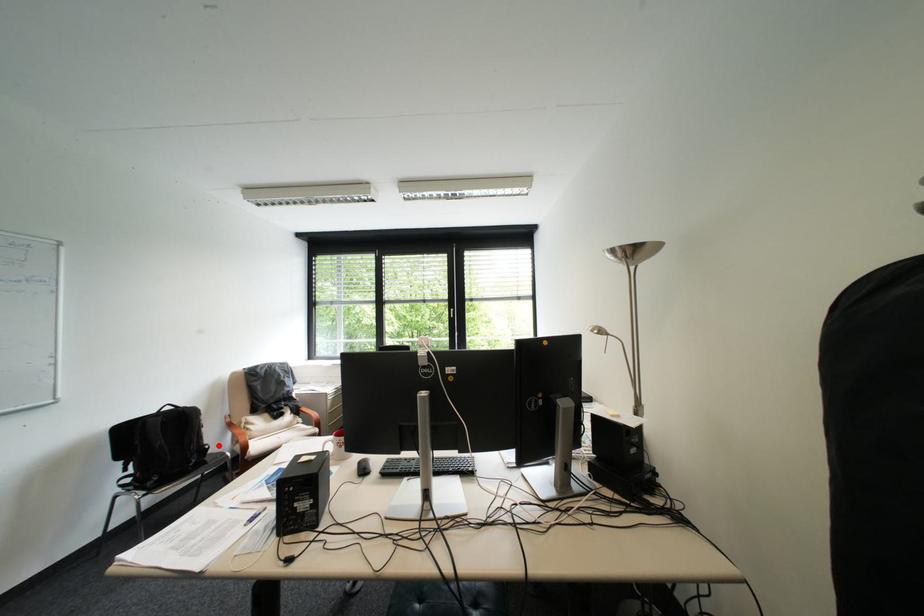
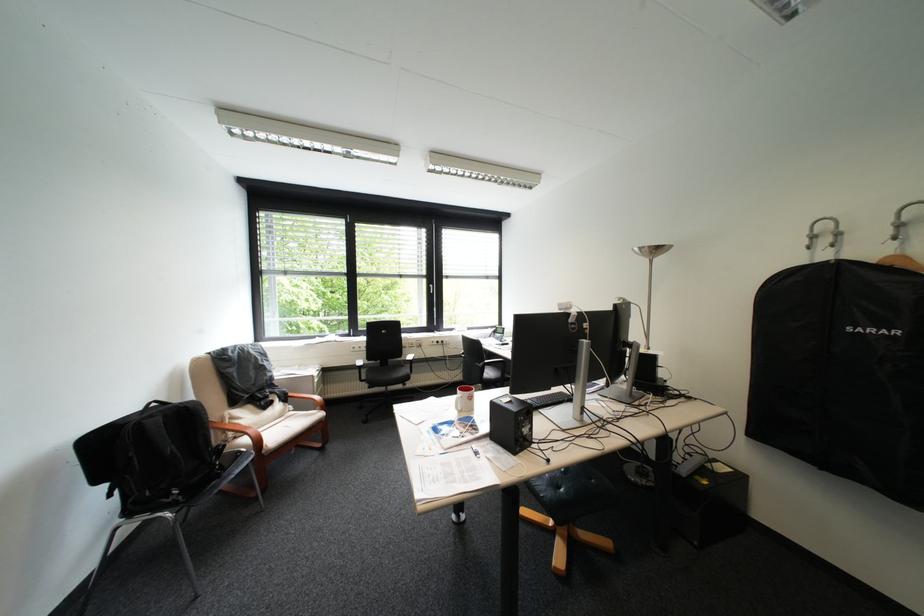
Locate, in the second image, the point that corresponds to the highlighted location in the first image.

(231, 445)